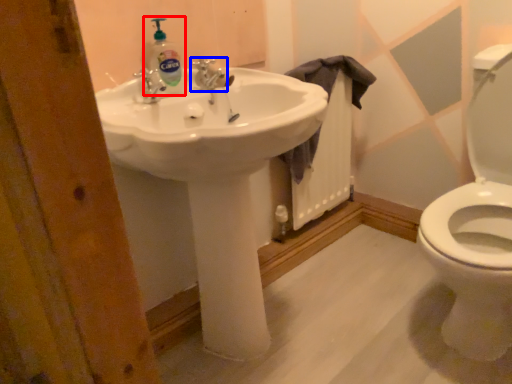
Question: Among these objects, which one is nearest to the camera, cleaning product (highlighted by a red box) or tap (highlighted by a blue box)?

Choices:
 (A) cleaning product
 (B) tap

Answer: (A)